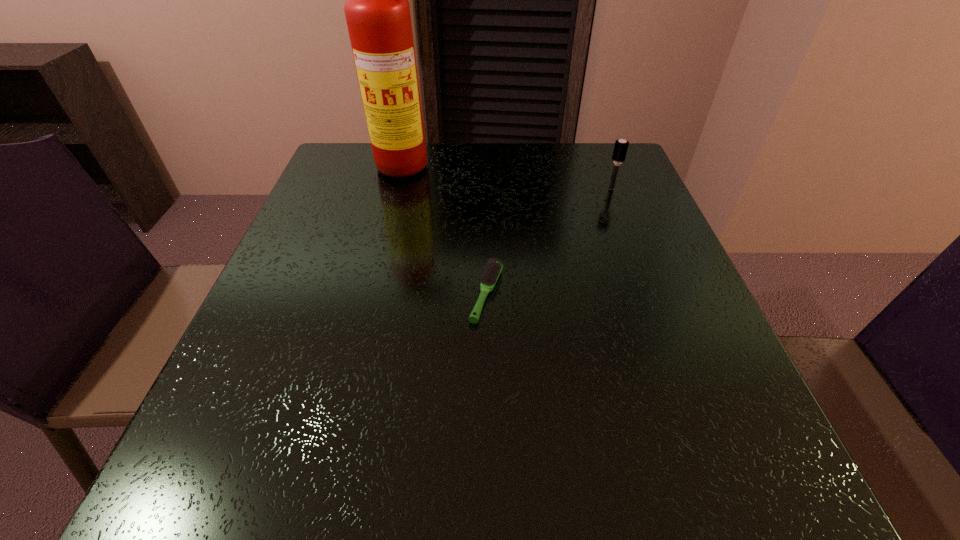
In the image, there is a desktop. Identify the location of free space at the near right corner. 792,495.

You are a GUI agent. You are given a task and a screenshot of the screen. Output one action in this format:
    pyautogui.click(x=<x>, y=<y>)
    Task: Click on the vacant point located between the shorter hairbrush and the right hairbrush
    
    Given the screenshot: What is the action you would take?
    pyautogui.click(x=549, y=241)

Where is `free point between the shorter hairbrush and the right hairbrush`? free point between the shorter hairbrush and the right hairbrush is located at coordinates (549, 241).

At what (x,y) coordinates should I click in order to perform the action: click on unoccupied area between the second nearest object and the tallest object. Please return your answer as a coordinate pair (x, y). Looking at the image, I should click on (511, 177).

At what (x,y) coordinates should I click in order to perform the action: click on empty location between the second object from right to left and the rightmost object. Please return your answer as a coordinate pair (x, y). Looking at the image, I should click on (549, 241).

Where is `empty space between the farther hairbrush and the nearest object`? empty space between the farther hairbrush and the nearest object is located at coordinates (549, 241).

Image resolution: width=960 pixels, height=540 pixels. In order to click on blank region between the second farthest object and the fire extinguisher in this screenshot , I will do `click(511, 177)`.

The image size is (960, 540). I want to click on free area in between the right hairbrush and the left hairbrush, so click(549, 241).

Locate an element on the screen. vacant space in between the tallest object and the second object from left to right is located at coordinates (448, 230).

Identify the location of vacant space that is in between the shorter hairbrush and the farther hairbrush. This screenshot has height=540, width=960. (549, 241).